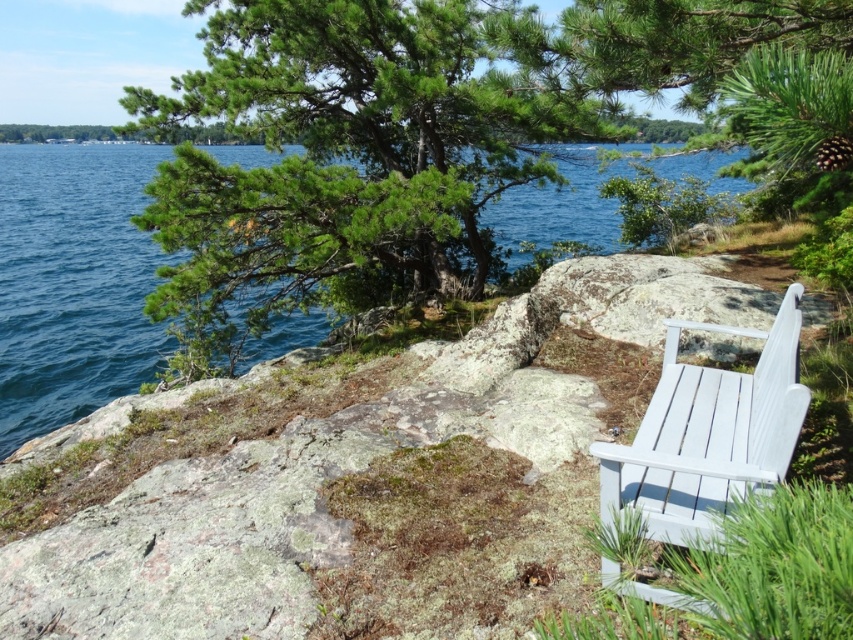
Which is below, white wood bench at right or white painted wood bench at right?

white wood bench at right is lower down.

Who is higher up, white wood bench at right or white painted wood bench at right?

white painted wood bench at right is above.

Which is in front, point (177, 602) or point (625, 582)?

Point (625, 582) is in front.

At what (x,y) coordinates should I click in order to perform the action: click on white wood bench at right. Please return your answer as a coordinate pair (x, y). Looking at the image, I should click on (357, 476).

Is point (38, 182) in front of point (769, 394)?

That is False.

Is blue water at upper left below white painted wood bench at right?

Actually, blue water at upper left is above white painted wood bench at right.

Locate an element on the screen. blue water at upper left is located at coordinates (73, 282).

Which is more to the left, white wood bench at right or blue water at upper left?

From the viewer's perspective, blue water at upper left appears more on the left side.

In the scene shown: Does white wood bench at right appear over blue water at upper left?

No, white wood bench at right is not above blue water at upper left.

Which is in front, point (276, 422) or point (161, 339)?

Point (276, 422) is more forward.

Identify the location of white wood bench at right. (357, 476).